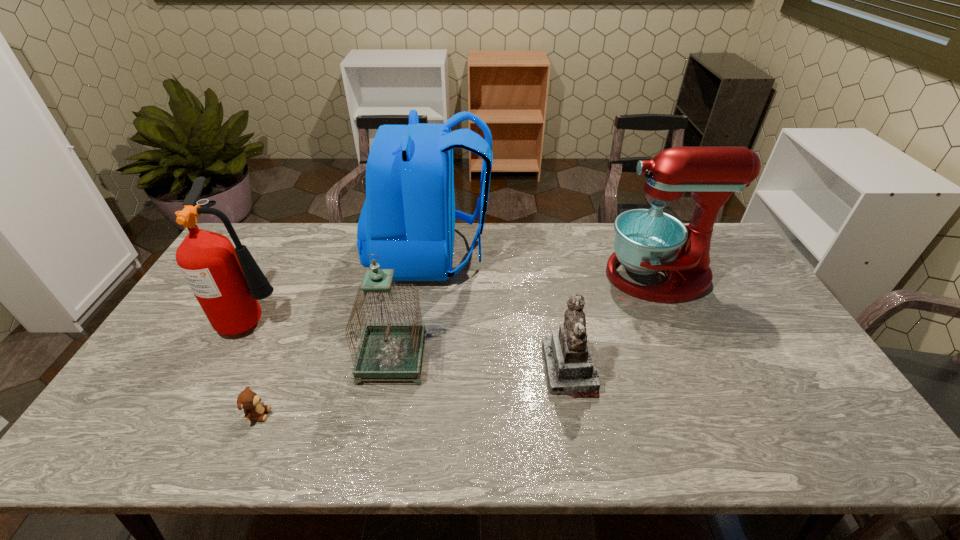
Image resolution: width=960 pixels, height=540 pixels. Find the location of `object located in the near edge section of the desktop`. object located in the near edge section of the desktop is located at coordinates (249, 401).

Locate an element on the screen. The height and width of the screenshot is (540, 960). object that is at the left edge is located at coordinates (227, 282).

Locate an element on the screen. This screenshot has width=960, height=540. object that is at the right edge is located at coordinates (647, 241).

Identify the location of object that is at the far right corner. The image size is (960, 540). (x=647, y=241).

In order to click on free point at the far edge in this screenshot , I will do click(x=458, y=247).

The height and width of the screenshot is (540, 960). In the image, there is a desktop. In order to click on vacant region at the near edge in this screenshot , I will do `click(608, 451)`.

What are the coordinates of `free location at the left edge` in the screenshot? It's located at (203, 350).

In the image, there is a desktop. Where is `blank space at the far left corner`? blank space at the far left corner is located at coordinates (259, 236).

The image size is (960, 540). I want to click on free space between the backpack and the shortest object, so click(345, 334).

Find the location of a particular element. free space between the mixer and the leftmost object is located at coordinates (456, 297).